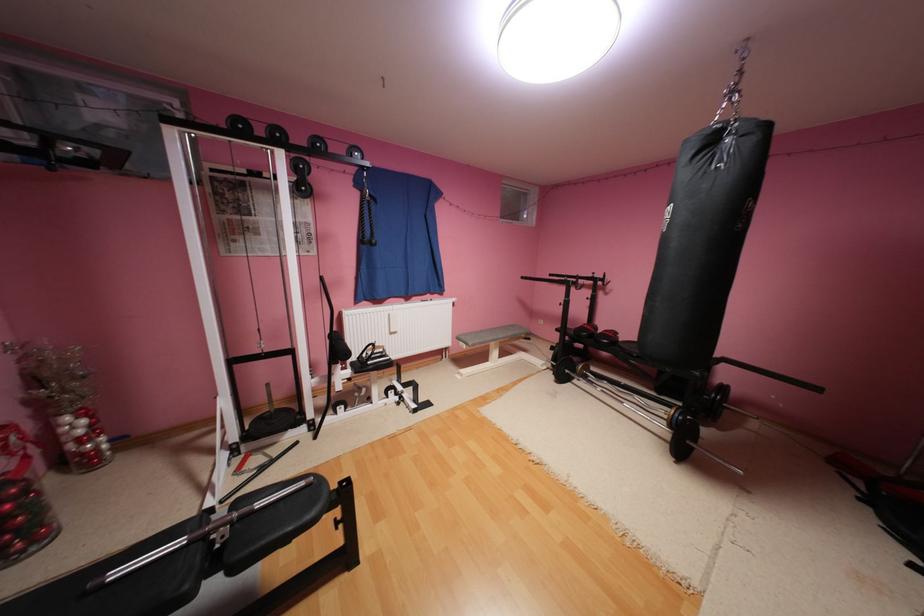
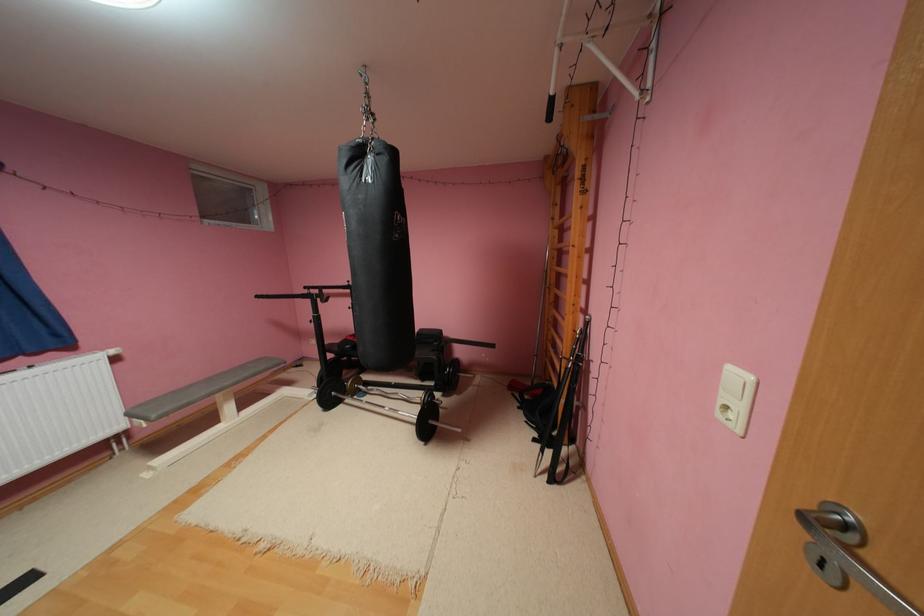
Question: The images are taken continuously from a first-person perspective. In which direction is your viewpoint rotating?

Choices:
 (A) Left
 (B) Right
 (C) Up
 (D) Down

Answer: (B)